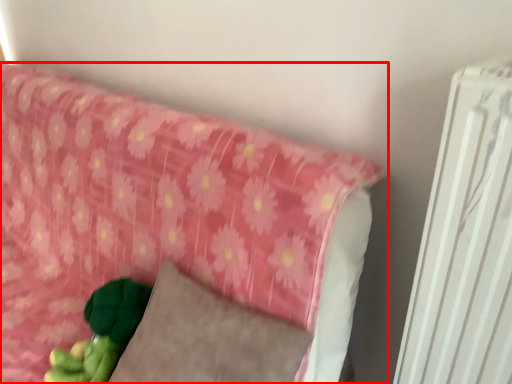
Question: Where is furniture (annotated by the red box) located in relation to pillow in the image?

Choices:
 (A) right
 (B) left

Answer: (B)